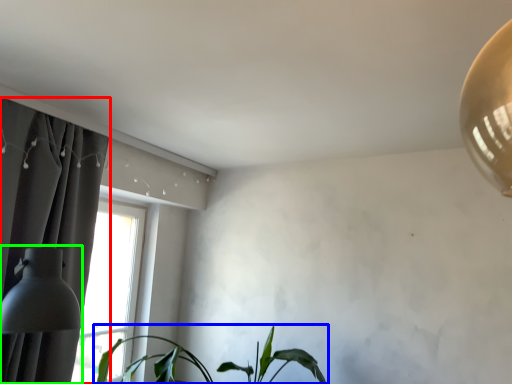
Question: Based on their relative distances, which object is nearer to curtain (highlighted by a red box)? Choose from houseplant (highlighted by a blue box) and table lamp (highlighted by a green box).

Choices:
 (A) houseplant
 (B) table lamp

Answer: (B)